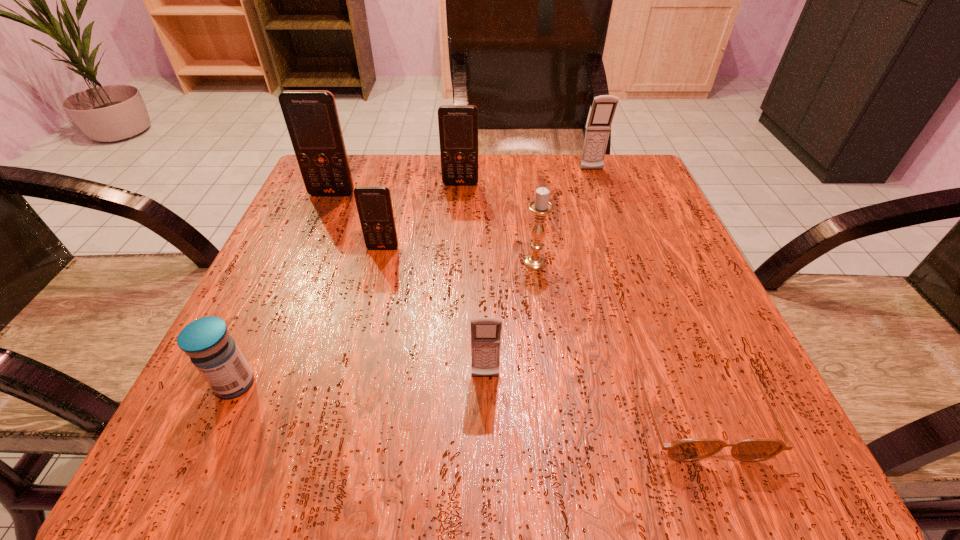
Locate an element on the screen. Image resolution: width=960 pixels, height=540 pixels. free space that is in between the second smallest orange cellular telephone and the second orange cellular telephone from left to right is located at coordinates (421, 216).

Where is `free area in between the left gray cellular telephone and the second smallest orange cellular telephone`? The height and width of the screenshot is (540, 960). free area in between the left gray cellular telephone and the second smallest orange cellular telephone is located at coordinates (473, 280).

Image resolution: width=960 pixels, height=540 pixels. Find the location of `vacant area between the farther gray cellular telephone and the shortest object`. vacant area between the farther gray cellular telephone and the shortest object is located at coordinates (643, 287).

In order to click on unoccupied area between the second farthest cellular telephone and the sunglasses in this screenshot , I will do `click(578, 294)`.

Image resolution: width=960 pixels, height=540 pixels. In order to click on free space between the second nearest cellular telephone and the fourth nearest cellular telephone in this screenshot , I will do `click(421, 216)`.

The image size is (960, 540). I want to click on vacant area that lies between the second farthest cellular telephone and the leftmost cellular telephone, so pyautogui.click(x=396, y=189).

Identify the location of vacant point located between the leftmost cellular telephone and the fifth farthest object. Image resolution: width=960 pixels, height=540 pixels. (434, 228).

Select which object is the second closest to the second shortest object. Please provide its 2D coordinates. Your answer should be formatted as a tuple, i.e. [(x, y)], where the tuple contains the x and y coordinates of a point satisfying the conditions above.

[(485, 332)]

Where is `object that is the fifth closest one to the fourth nearest cellular telephone`? This screenshot has height=540, width=960. object that is the fifth closest one to the fourth nearest cellular telephone is located at coordinates (485, 332).

This screenshot has height=540, width=960. I want to click on cellular telephone that is the second closest to the medicine, so click(485, 332).